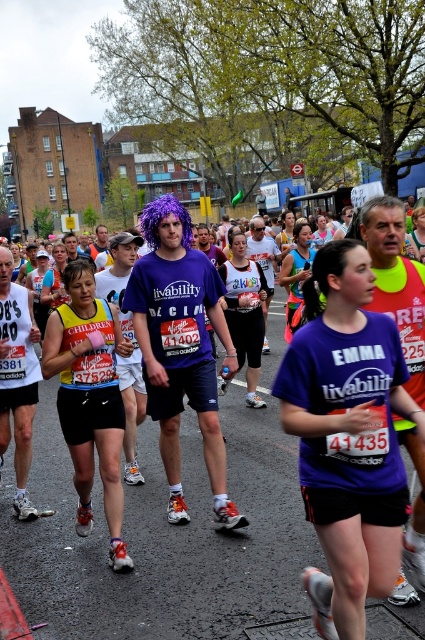
You are a photographer capturing the marathon runners. You need to position yourself so that the purple synthetic wig at center and the yellow reflective vest at center are both in your shot. Based on their positions, which object should you frame first to ensure both are visible?

The yellow reflective vest at center should be framed first since the purple synthetic wig at center is to the right of it. Positioning the vest on the left side of the frame allows the wig to naturally fit to the right, keeping both in view.

You are a photographer standing at the starting line of the marathon. You want to take a closeup shot of the purple fabric shirt at center. Given that your camera can focus on subjects within 2 meters, will you be able to capture a clear closeup?

The purple fabric shirt at center is 2.86 meters away from the viewer. Since the camera can focus within 2 meters, the distance is too far to capture a clear closeup.

Looking at this image, you are a photographer at the marathon event and want to capture the purple fabric shirt at center. Based on its coordinates, where should you aim your camera?

The purple fabric shirt at center is located at coordinates point (348, 436), so aim your camera there to capture it.